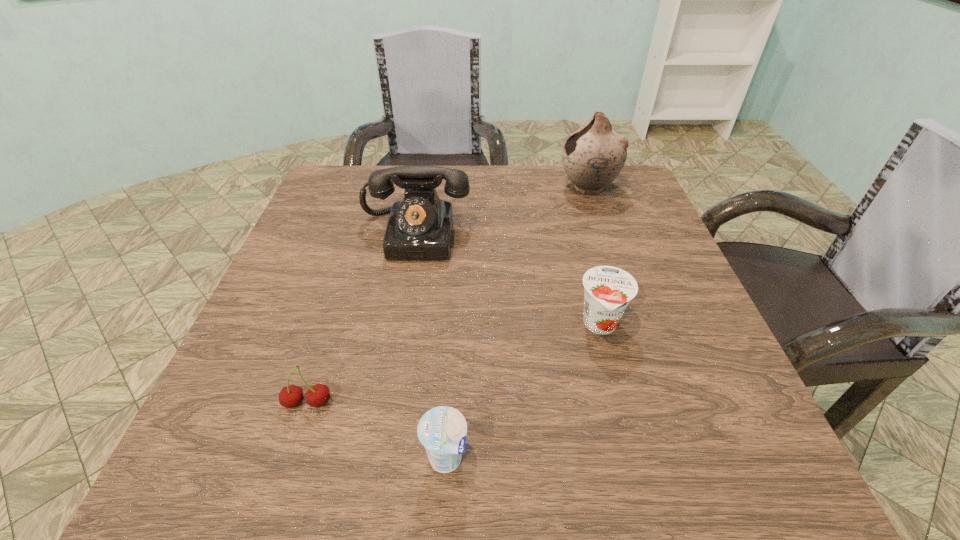
Identify the location of cherry located at the left edge. (291, 396).

Where is `pottery at the right edge`? The height and width of the screenshot is (540, 960). pottery at the right edge is located at coordinates (593, 156).

Identify the location of yogurt that is at the right edge. (608, 290).

Locate an element on the screen. object at the far left corner is located at coordinates (419, 227).

Where is `object that is positioned at the far right corner`? This screenshot has height=540, width=960. object that is positioned at the far right corner is located at coordinates (593, 156).

Identify the location of blank area at the far edge. This screenshot has width=960, height=540. (521, 179).

Find the location of a particular element. vacant position at the near edge of the desktop is located at coordinates (629, 481).

This screenshot has height=540, width=960. In order to click on vacant space at the left edge in this screenshot , I will do `click(347, 262)`.

Find the location of a particular element. Image resolution: width=960 pixels, height=540 pixels. vacant region at the right edge of the desktop is located at coordinates (686, 407).

This screenshot has width=960, height=540. In the image, there is a desktop. Identify the location of vacant region at the far left corner. (341, 168).